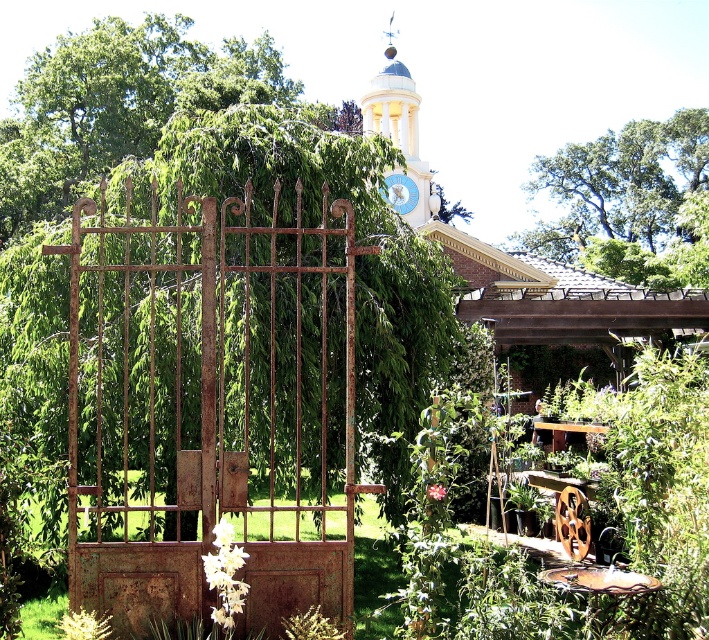
You are a visitor standing in front of the garden gate and want to take a photo of the white painted stone clock tower at upper center and the metallic clock at center. Which one will appear larger in the photo?

The white painted stone clock tower at upper center will appear larger in the photo because it is closer to the viewer than the metallic clock at center.

You are standing in the garden and want to take a photo of the rusty metal gate at center and the green leafy tree at upper center. Which object should you zoom in on to capture both in the frame without moving your camera?

The rusty metal gate at center is smaller than the green leafy tree at upper center, so you should zoom in on the green leafy tree at upper center to ensure both fit in the frame.

You are a gardener standing in front of the garden and want to water the green leafy tree at upper center. You have a watering can in your hand. To reach the tree, you need to pass through the rusty metal gate at center. Is the gate to the left or right of the tree?

The rusty metal gate at center is positioned on the left side of green leafy tree at upper center, so the gate is to the left of the tree.